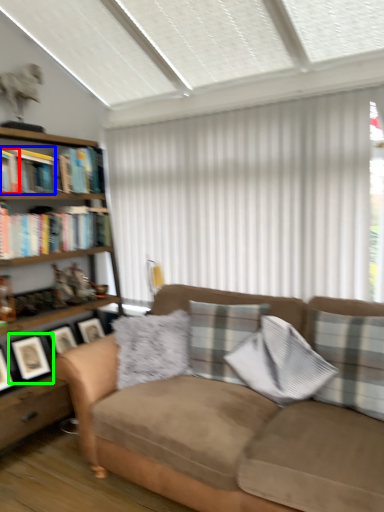
Question: Which is nearer to the book (highlighted by a red box)? book (highlighted by a blue box) or picture frame (highlighted by a green box).

Choices:
 (A) book
 (B) picture frame

Answer: (A)